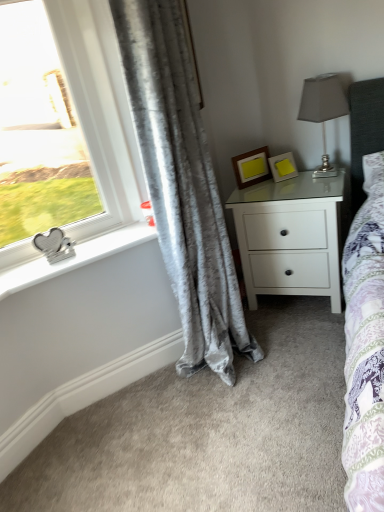
Question: From the image's perspective, is wooden picture frame at center, which is the first picture frame from left to right, on white matte nightstand at center-right?

Choices:
 (A) no
 (B) yes

Answer: (B)

Question: Is white matte nightstand at center-right surrounded by wooden picture frame at center, which is counted as the second picture frame, starting from the right?

Choices:
 (A) yes
 (B) no

Answer: (B)

Question: Is wooden picture frame at center, which is counted as the second picture frame, starting from the right, positioned in front of white matte nightstand at center-right?

Choices:
 (A) yes
 (B) no

Answer: (B)

Question: Can you confirm if wooden picture frame at center, which is counted as the second picture frame, starting from the right, is taller than white matte nightstand at center-right?

Choices:
 (A) no
 (B) yes

Answer: (A)

Question: Can you confirm if wooden picture frame at center, which is the first picture frame from left to right, is wider than white matte nightstand at center-right?

Choices:
 (A) no
 (B) yes

Answer: (A)

Question: Considering their positions, is velvet gray curtain at left located in front of or behind yellow matte picture frame at upper right, the second picture frame positioned from the left?

Choices:
 (A) front
 (B) behind

Answer: (A)

Question: Is velvet gray curtain at left bigger or smaller than yellow matte picture frame at upper right, the first picture frame from the right?

Choices:
 (A) small
 (B) big

Answer: (B)

Question: From their relative heights in the image, would you say velvet gray curtain at left is taller or shorter than yellow matte picture frame at upper right, the first picture frame from the right?

Choices:
 (A) tall
 (B) short

Answer: (A)

Question: From the image's perspective, is velvet gray curtain at left located above or below yellow matte picture frame at upper right, the first picture frame from the right?

Choices:
 (A) above
 (B) below

Answer: (B)

Question: Is silver metallic heart-shaped object at left spatially inside yellow matte picture frame at upper right, the second picture frame positioned from the left, or outside of it?

Choices:
 (A) outside
 (B) inside

Answer: (A)

Question: From a real-world perspective, relative to yellow matte picture frame at upper right, the first picture frame from the right, is silver metallic heart-shaped object at left vertically above or below?

Choices:
 (A) above
 (B) below

Answer: (B)

Question: Is point (14, 276) positioned closer to the camera than point (276, 174)?

Choices:
 (A) closer
 (B) farther

Answer: (A)

Question: In terms of width, does silver metallic heart-shaped object at left look wider or thinner when compared to yellow matte picture frame at upper right, the second picture frame positioned from the left?

Choices:
 (A) thin
 (B) wide

Answer: (B)

Question: Is wooden picture frame at center, which is counted as the second picture frame, starting from the right, inside the boundaries of white matte nightstand at center-right, or outside?

Choices:
 (A) outside
 (B) inside

Answer: (A)

Question: In the image, is wooden picture frame at center, which is counted as the second picture frame, starting from the right, on the left side or the right side of white matte nightstand at center-right?

Choices:
 (A) left
 (B) right

Answer: (A)